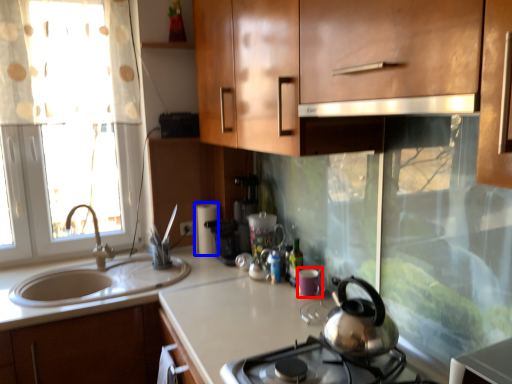
Question: Among these objects, which one is farthest to the camera, appliance (highlighted by a red box) or appliance (highlighted by a blue box)?

Choices:
 (A) appliance
 (B) appliance

Answer: (B)